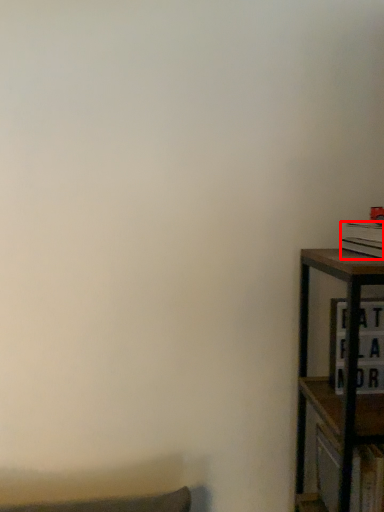
Question: From the image's perspective, considering the relative positions of book (annotated by the red box) and cabinet in the image provided, where is book (annotated by the red box) located with respect to the staircase?

Choices:
 (A) below
 (B) above

Answer: (B)